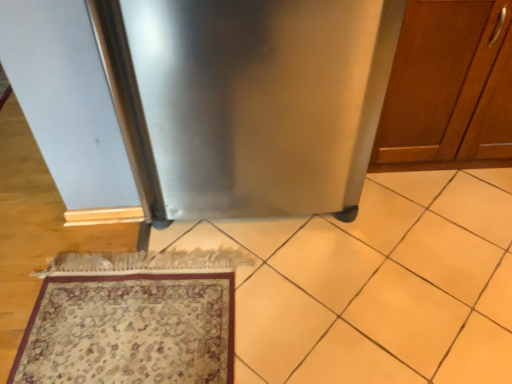
The width and height of the screenshot is (512, 384). What do you see at coordinates (248, 101) in the screenshot? I see `stainless steel refrigerator at center` at bounding box center [248, 101].

The image size is (512, 384). Describe the element at coordinates (130, 330) in the screenshot. I see `carpeted rug at lower left` at that location.

The image size is (512, 384). In order to click on wooden cabinet at right in this screenshot , I will do `click(449, 85)`.

The image size is (512, 384). Find the location of `stainless steel refrigerator at center`. stainless steel refrigerator at center is located at coordinates (248, 101).

Which point is more distant from viewer, [453,128] or [222,214]?

The point [453,128] is farther.

From a real-world perspective, who is located lower, wooden cabinet at right or stainless steel refrigerator at center?

wooden cabinet at right, from a real-world perspective.

How many degrees apart are the facing directions of wooden cabinet at right and stainless steel refrigerator at center?

The facing directions of wooden cabinet at right and stainless steel refrigerator at center are 0.947 degrees apart.

From the picture: Considering the relative sizes of wooden cabinet at right and stainless steel refrigerator at center in the image provided, is wooden cabinet at right bigger than stainless steel refrigerator at center?

No, wooden cabinet at right is not bigger than stainless steel refrigerator at center.

Locate an element on the screen. Image resolution: width=512 pixels, height=384 pixels. mat below the wooden cabinet at right (from a real-world perspective) is located at coordinates (130, 330).

Could you tell me if wooden cabinet at right is turned towards carpeted rug at lower left?

No, wooden cabinet at right does not turn towards carpeted rug at lower left.

Who is smaller, wooden cabinet at right or carpeted rug at lower left?

carpeted rug at lower left.

Does wooden cabinet at right appear on the left side of carpeted rug at lower left?

No, wooden cabinet at right is not to the left of carpeted rug at lower left.

Can you tell me how much stainless steel refrigerator at center and carpeted rug at lower left differ in facing direction?

93.6 degrees.

Is stainless steel refrigerator at center not close to carpeted rug at lower left?

stainless steel refrigerator at center is actually quite close to carpeted rug at lower left.

Could carpeted rug at lower left be considered to be inside stainless steel refrigerator at center?

No, carpeted rug at lower left is located outside of stainless steel refrigerator at center.

How distant is carpeted rug at lower left from stainless steel refrigerator at center?

A distance of 51.73 centimeters exists between carpeted rug at lower left and stainless steel refrigerator at center.

I want to click on mat to the left of stainless steel refrigerator at center, so click(x=130, y=330).

Based on their sizes in the image, would you say carpeted rug at lower left is bigger or smaller than stainless steel refrigerator at center?

carpeted rug at lower left is smaller than stainless steel refrigerator at center.

Considering the positions of points (151, 326) and (322, 187), is point (151, 326) farther from camera compared to point (322, 187)?

No, (151, 326) is in front of (322, 187).

Is carpeted rug at lower left shorter than wooden cabinet at right?

Yes, carpeted rug at lower left is shorter than wooden cabinet at right.

Is carpeted rug at lower left placed right next to wooden cabinet at right?

No, carpeted rug at lower left is not in contact with wooden cabinet at right.

Locate an element on the screen. This screenshot has width=512, height=384. mat located in front of the wooden cabinet at right is located at coordinates (130, 330).

Is wooden cabinet at right a part of stainless steel refrigerator at center?

No, stainless steel refrigerator at center does not contain wooden cabinet at right.

From the picture: Between stainless steel refrigerator at center and wooden cabinet at right, which one has less height?

Standing shorter between the two is wooden cabinet at right.

From the image's perspective, is stainless steel refrigerator at center above or below wooden cabinet at right?

Clearly, from the image's perspective, stainless steel refrigerator at center is below wooden cabinet at right.

From a real-world perspective, is stainless steel refrigerator at center on top of wooden cabinet at right?

Yes, from a real-world perspective, stainless steel refrigerator at center is above wooden cabinet at right.

The width and height of the screenshot is (512, 384). In order to click on appliance on the left of the wooden cabinet at right in this screenshot , I will do `click(248, 101)`.

Find the location of a particular element. Image resolution: width=512 pixels, height=384 pixels. cabinetry above the carpeted rug at lower left (from a real-world perspective) is located at coordinates (449, 85).

Looking at the image, which one is located further to wooden cabinet at right, stainless steel refrigerator at center or carpeted rug at lower left?

Among the two, carpeted rug at lower left is located further to wooden cabinet at right.

In the scene shown: Looking at the image, which one is located further to stainless steel refrigerator at center, wooden cabinet at right or carpeted rug at lower left?

carpeted rug at lower left lies further to stainless steel refrigerator at center than the other object.

From the picture: When comparing their distances from carpeted rug at lower left, does wooden cabinet at right or stainless steel refrigerator at center seem closer?

stainless steel refrigerator at center.

When comparing their distances from wooden cabinet at right, does carpeted rug at lower left or stainless steel refrigerator at center seem further?

carpeted rug at lower left is positioned further to the anchor wooden cabinet at right.

Looking at the image, which one is located closer to stainless steel refrigerator at center, carpeted rug at lower left or wooden cabinet at right?

Based on the image, wooden cabinet at right appears to be nearer to stainless steel refrigerator at center.

Considering their positions, is stainless steel refrigerator at center positioned further to carpeted rug at lower left than wooden cabinet at right?

Among the two, wooden cabinet at right is located further to carpeted rug at lower left.

Where is `appliance between carpeted rug at lower left and wooden cabinet at right in the horizontal direction`? The height and width of the screenshot is (384, 512). appliance between carpeted rug at lower left and wooden cabinet at right in the horizontal direction is located at coordinates (248, 101).